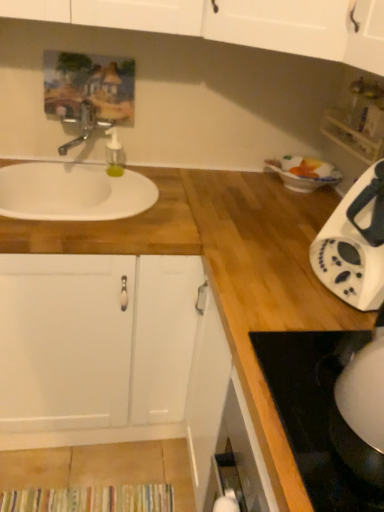
Question: Is white glossy electric kettle at lower right to the left of white glossy kettle at lower right from the viewer's perspective?

Choices:
 (A) yes
 (B) no

Answer: (B)

Question: Can you confirm if white glossy electric kettle at lower right is bigger than white glossy kettle at lower right?

Choices:
 (A) yes
 (B) no

Answer: (B)

Question: Is white glossy electric kettle at lower right oriented towards white glossy kettle at lower right?

Choices:
 (A) yes
 (B) no

Answer: (B)

Question: Is white glossy electric kettle at lower right next to white glossy kettle at lower right?

Choices:
 (A) yes
 (B) no

Answer: (B)

Question: From the image's perspective, does white glossy electric kettle at lower right appear lower than white glossy kettle at lower right?

Choices:
 (A) no
 (B) yes

Answer: (A)

Question: From a real-world perspective, is white glossy electric kettle at lower right on top of white glossy kettle at lower right?

Choices:
 (A) yes
 (B) no

Answer: (A)

Question: From the image's perspective, is white wood countertop at left under white plastic toaster at right?

Choices:
 (A) no
 (B) yes

Answer: (A)

Question: Can you confirm if white wood countertop at left is thinner than white plastic toaster at right?

Choices:
 (A) no
 (B) yes

Answer: (A)

Question: Is white wood countertop at left to the left of white plastic toaster at right from the viewer's perspective?

Choices:
 (A) yes
 (B) no

Answer: (A)

Question: Is white wood countertop at left directly adjacent to white plastic toaster at right?

Choices:
 (A) no
 (B) yes

Answer: (A)

Question: Can we say white wood countertop at left lies outside white plastic toaster at right?

Choices:
 (A) yes
 (B) no

Answer: (A)

Question: Does white wood countertop at left lie in front of white plastic toaster at right?

Choices:
 (A) no
 (B) yes

Answer: (A)

Question: Would you consider white plastic toaster at right to be distant from white glossy kettle at lower right?

Choices:
 (A) no
 (B) yes

Answer: (A)